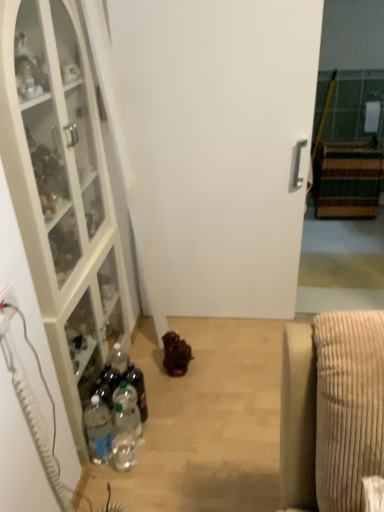
Where is `free space that is in between white matte door at center and clear plastic bottle at lower left, which is the 1th bottle in left-to-right order`? The height and width of the screenshot is (512, 384). free space that is in between white matte door at center and clear plastic bottle at lower left, which is the 1th bottle in left-to-right order is located at coordinates (202, 357).